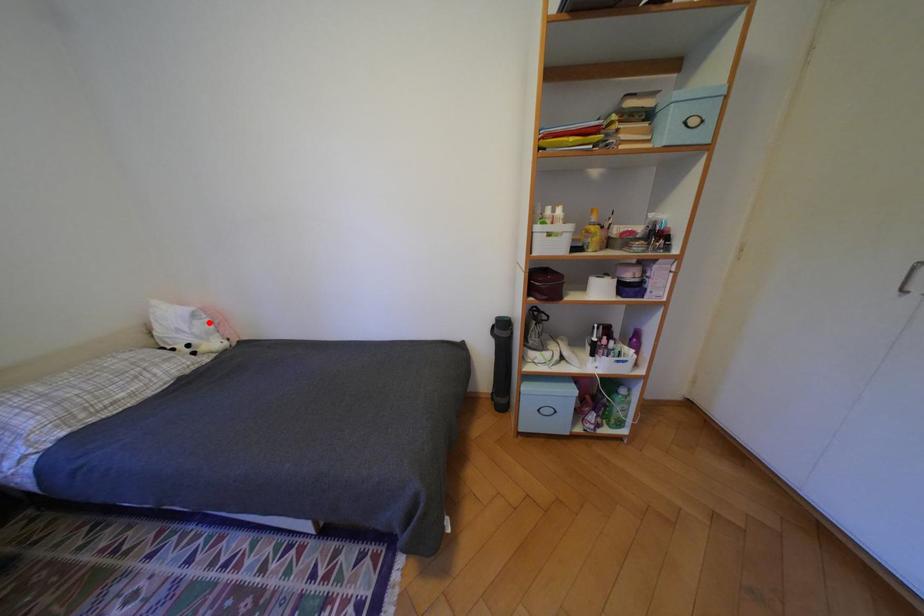
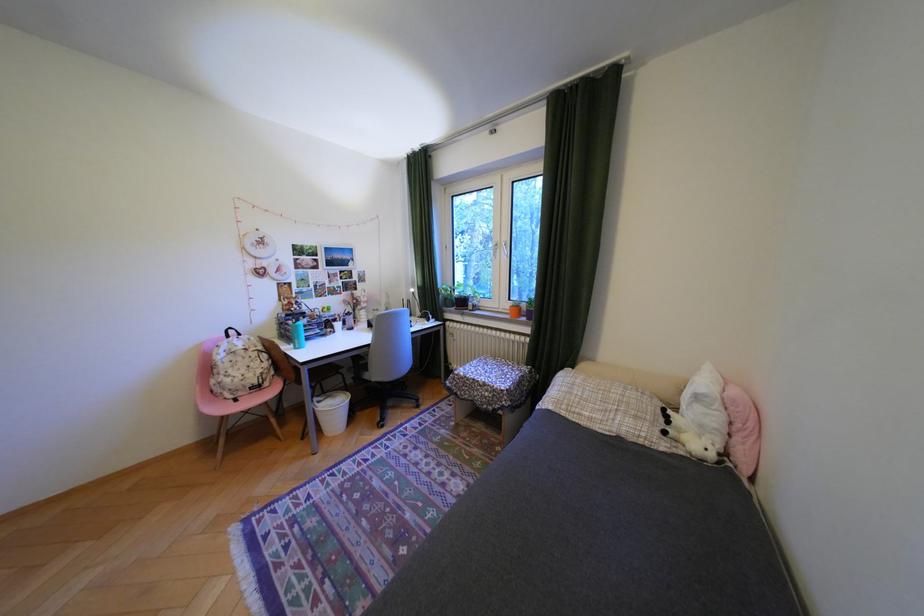
The point at the highlighted location is marked in the first image. Where is the corresponding point in the second image?

(710, 408)